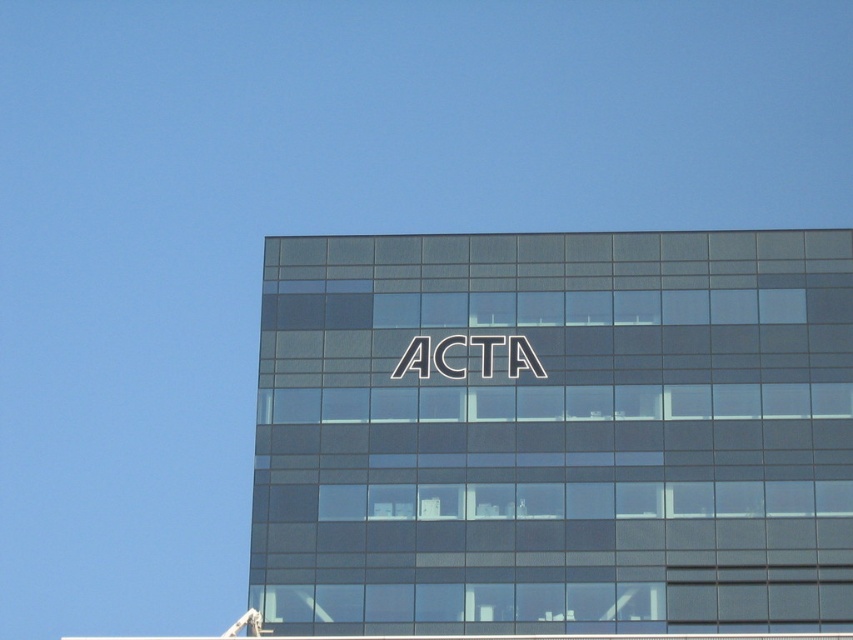
You are an architect designing a new building. You want to place a decorative element on the facade between the satin glass building at center and the white metallic logo at center. Considering their sizes, which object should the decorative element be placed closer to?

The satin glass building at center is wider than the white metallic logo at center, so the decorative element should be placed closer to the white metallic logo at center to balance the design.

You are standing in a park and see the satin glass building at center. If you want to take a photo of it from a distance of exactly 60 meters, should you move closer or farther away?

The satin glass building at center is currently 59.03 meters away. To reach exactly 60 meters, you need to move slightly farther away from the building.